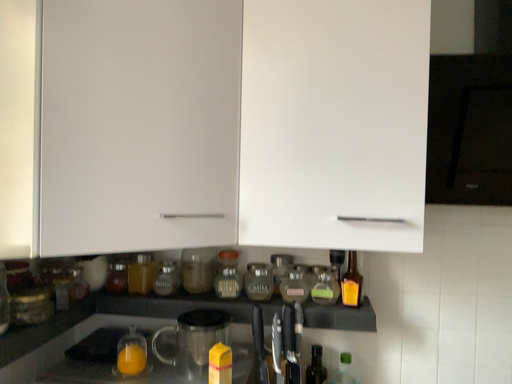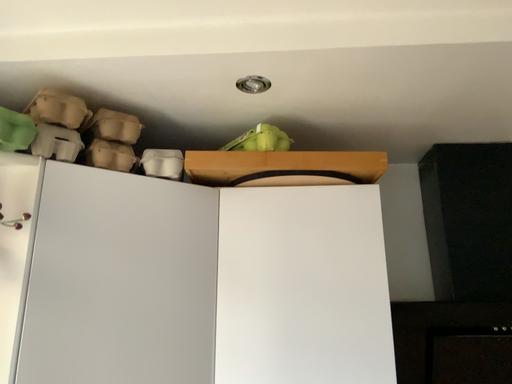
Question: How did the camera likely rotate when shooting the video?

Choices:
 (A) rotated upward
 (B) rotated downward

Answer: (A)